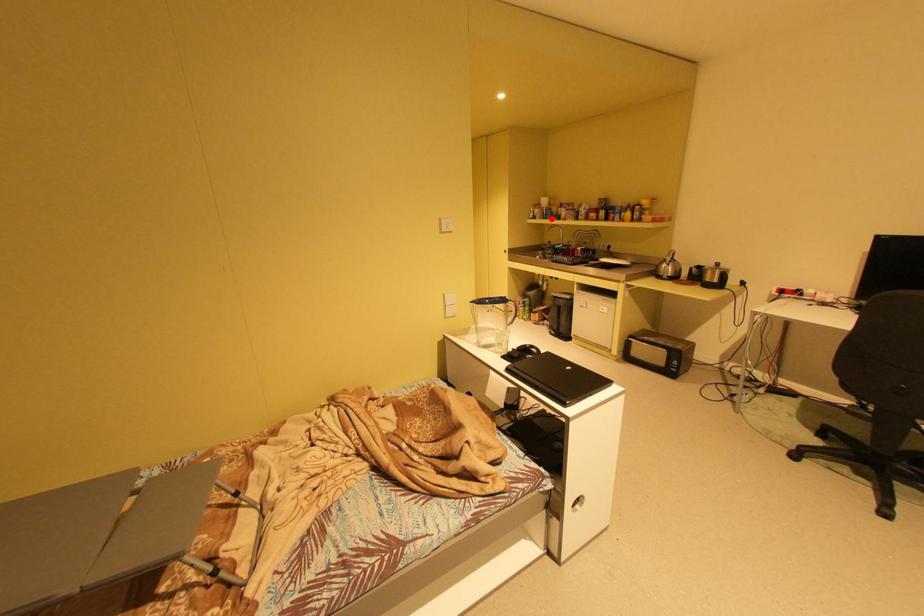
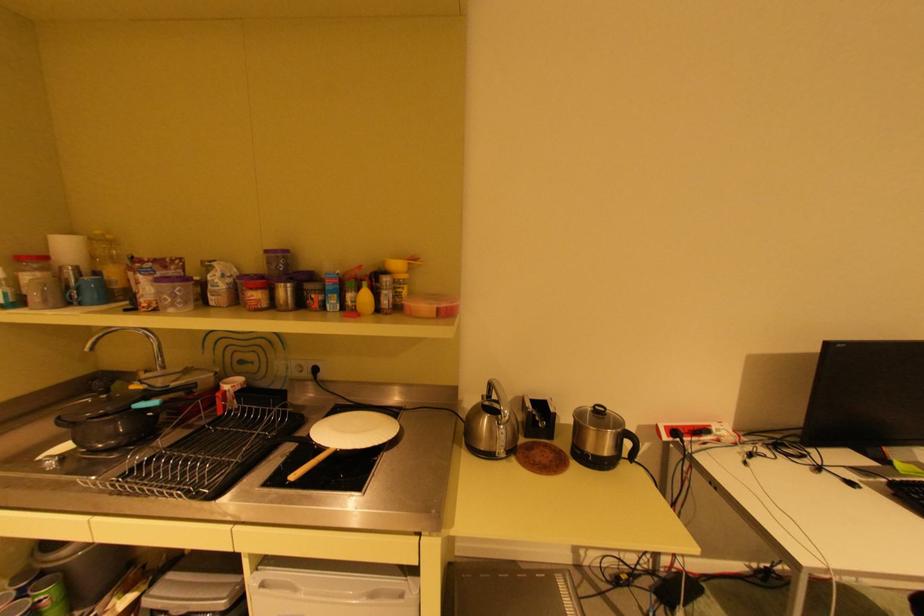
Question: A red point is marked in image1. In image2, is the corresponding 3D point closer to the camera or farther? Reply with the corresponding letter.

Choices:
 (A) The corresponding 3D point is closer.
 (B) The corresponding 3D point is farther.

Answer: (B)